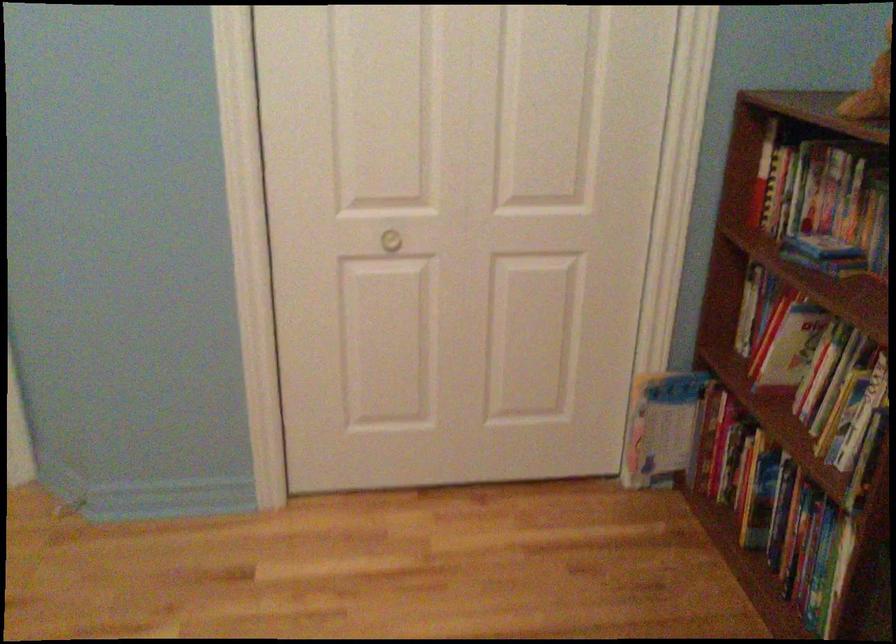
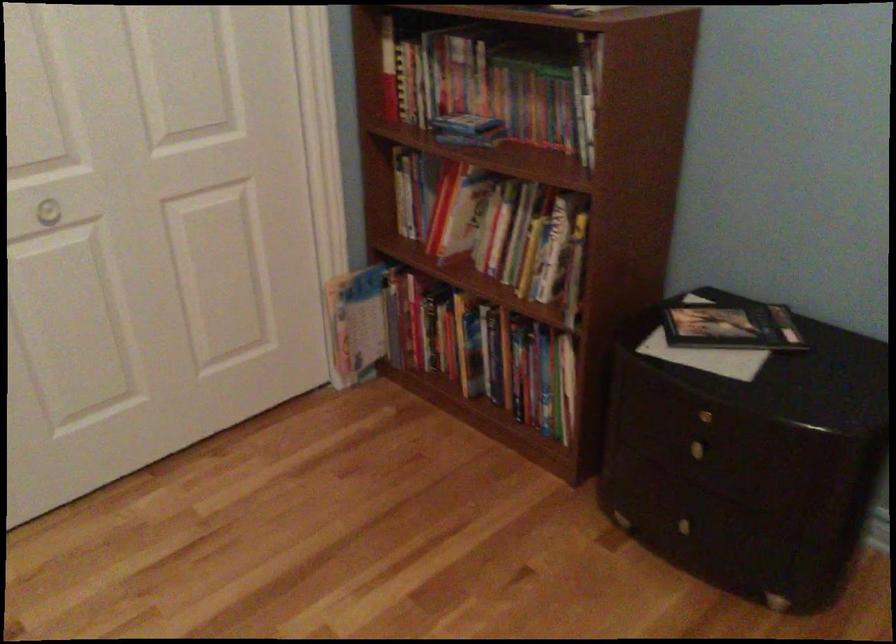
Question: Based on the continuous images, in which direction is the camera rotating? Reply with the corresponding letter.

Choices:
 (A) Left
 (B) Right
 (C) Up
 (D) Down

Answer: (B)